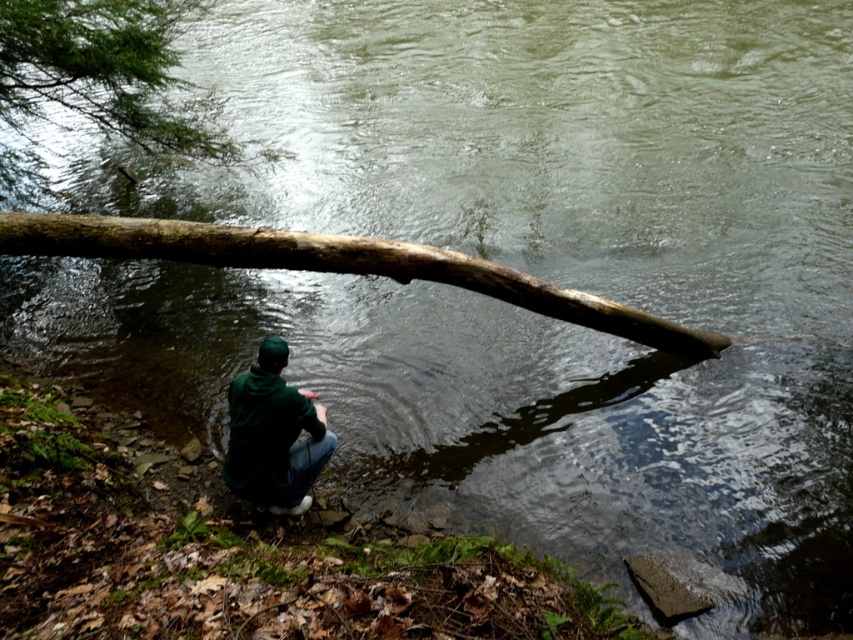
You are standing at the edge of the river and want to cross to the other side. The brown rough log at center is in the middle of the river. If the river is 10 meters wide, can you use the log to cross safely?

The brown rough log at center is 6.53 meters away from you. Since the river is 10 meters wide, the log spans less than half the river. It might not be safe to use the log to cross the entire river as there may be a gap on the other side.

You are standing at the riverbank and want to place a small rock on the point that is closer to you. Which point should you choose between point (675, 346) and point (312, 470)?

Point (312, 470) is closer to you, so you should place the rock there.

You are a photographer wanting to capture the dark green hoodie at lower center and the brown rough log at center in the same frame. Since the log is above the hoodie, where should you position your camera relative to the hoodie to include both in the shot?

Since the brown rough log at center is above the dark green hoodie at lower center, you should position your camera above the hoodie to capture both the hoodie and the log in the same frame.